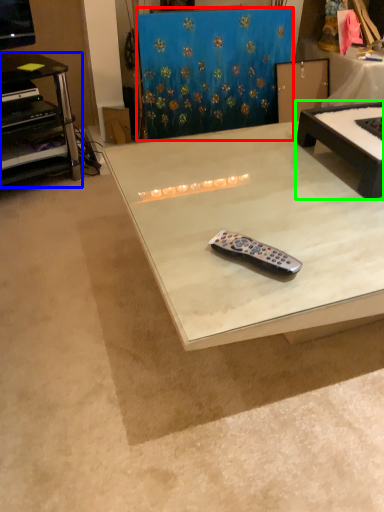
Question: Which object is positioned farthest from curtain (highlighted by a red box)? Select from desk (highlighted by a blue box) and table (highlighted by a green box).

Choices:
 (A) desk
 (B) table

Answer: (B)